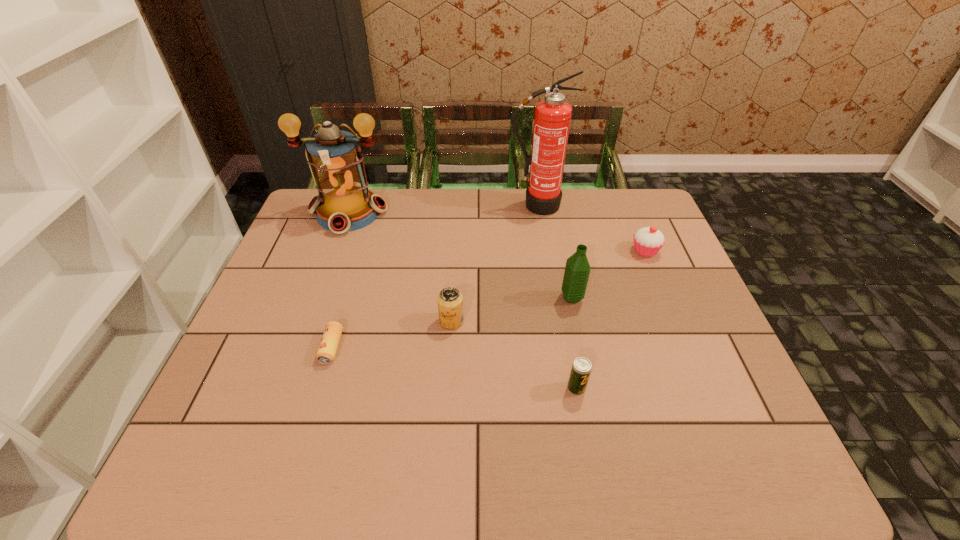
Identify the location of unoccupied position between the leftmost beer can and the lantern. (340, 280).

This screenshot has width=960, height=540. Identify the location of free area in between the fourth farthest object and the second tallest beer can. (574, 343).

In order to click on free space between the lantern and the farthest beer can in this screenshot , I will do `click(400, 267)`.

The height and width of the screenshot is (540, 960). What are the coordinates of `vacant area that lies between the rightmost object and the fire extinguisher` in the screenshot? It's located at (590, 228).

You are a GUI agent. You are given a task and a screenshot of the screen. Output one action in this format:
    pyautogui.click(x=<x>, y=<y>)
    Task: Click on the empty space that is in between the cupcake and the nearest beer can
    The image size is (960, 540).
    Given the screenshot: What is the action you would take?
    click(x=611, y=320)

The width and height of the screenshot is (960, 540). Identify the location of vacant point located between the sixth shortest object and the cupcake. (497, 232).

The height and width of the screenshot is (540, 960). Find the location of `empty space between the tallest object and the second tallest beer can`. empty space between the tallest object and the second tallest beer can is located at coordinates (556, 296).

The image size is (960, 540). Identify the location of object that is the second closest to the tallest object. (577, 271).

Point out which object is positioned as the sixth nearest to the tallest object. Please provide its 2D coordinates. Your answer should be formatted as a tuple, i.e. [(x, y)], where the tuple contains the x and y coordinates of a point satisfying the conditions above.

[(328, 346)]

At what (x,y) coordinates should I click in order to perform the action: click on beer can that is the third closest to the rightmost object. Please return your answer as a coordinate pair (x, y). This screenshot has height=540, width=960. Looking at the image, I should click on (328, 346).